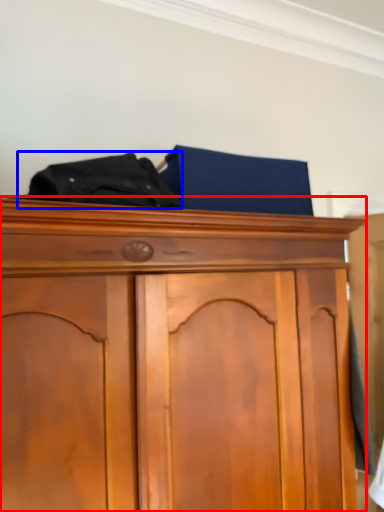
Question: Among these objects, which one is nearest to the camera, cupboard (highlighted by a red box) or underclothes (highlighted by a blue box)?

Choices:
 (A) cupboard
 (B) underclothes

Answer: (A)